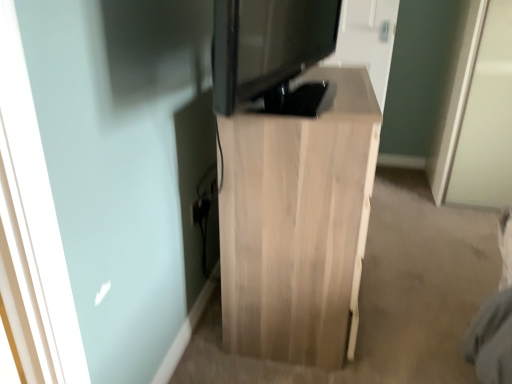
Question: Is matte black monitor at center to the left or to the right of light wood cabinet at center in the image?

Choices:
 (A) left
 (B) right

Answer: (A)

Question: Is matte black monitor at center wider or thinner than light wood cabinet at center?

Choices:
 (A) thin
 (B) wide

Answer: (A)

Question: From the image's perspective, is matte black monitor at center positioned above or below light wood cabinet at center?

Choices:
 (A) above
 (B) below

Answer: (A)

Question: Looking at their shapes, would you say light wood cabinet at center is wider or thinner than matte black monitor at center?

Choices:
 (A) thin
 (B) wide

Answer: (B)

Question: In terms of height, does light wood cabinet at center look taller or shorter compared to matte black monitor at center?

Choices:
 (A) short
 (B) tall

Answer: (B)

Question: From a real-world perspective, relative to matte black monitor at center, is light wood cabinet at center vertically above or below?

Choices:
 (A) below
 (B) above

Answer: (A)

Question: Looking at the image, does light wood cabinet at center seem bigger or smaller compared to matte black monitor at center?

Choices:
 (A) big
 (B) small

Answer: (A)